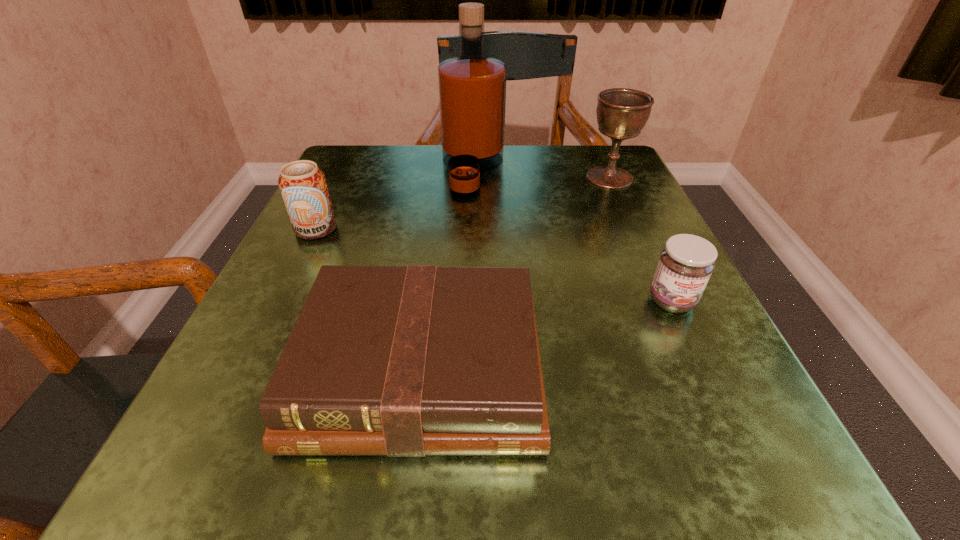
Find the location of a particular element. Image resolution: width=960 pixels, height=540 pixels. empty space that is in between the second shortest object and the beer can is located at coordinates (493, 265).

Image resolution: width=960 pixels, height=540 pixels. Find the location of `free space between the third tallest object and the liquor`. free space between the third tallest object and the liquor is located at coordinates (395, 200).

Where is `free space between the fourth shortest object and the third farthest object`? free space between the fourth shortest object and the third farthest object is located at coordinates (463, 204).

Locate an element on the screen. vacant space that's between the leftmost object and the fourth shortest object is located at coordinates (463, 204).

Find the location of a particular element. Image resolution: width=960 pixels, height=540 pixels. object that is the third closest one to the chalice is located at coordinates (406, 361).

Locate an element on the screen. This screenshot has width=960, height=540. object that is the third closest to the shortest object is located at coordinates (472, 88).

Identify the location of vacant region that satisfies the following two spatial constraints: 1. on the front label of the second tallest object; 2. on the left side of the tallest object. [472, 178].

This screenshot has width=960, height=540. I want to click on free space that satisfies the following two spatial constraints: 1. on the front label of the tallest object; 2. on the spine side of the shortest object, so click(468, 370).

Where is `vacant area in the image that satisfies the following two spatial constraints: 1. on the front label of the tallest object; 2. on the spine side of the Bible`? The height and width of the screenshot is (540, 960). vacant area in the image that satisfies the following two spatial constraints: 1. on the front label of the tallest object; 2. on the spine side of the Bible is located at coordinates (468, 370).

Where is `blank area in the image that satisfies the following two spatial constraints: 1. on the back side of the third nearest object; 2. on the left side of the chalice`? This screenshot has height=540, width=960. blank area in the image that satisfies the following two spatial constraints: 1. on the back side of the third nearest object; 2. on the left side of the chalice is located at coordinates (341, 178).